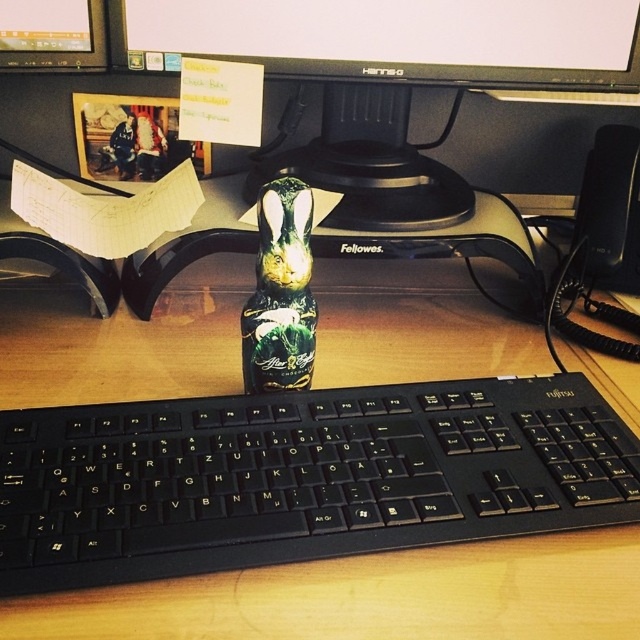
Which is more to the left, black glossy computer monitor at upper center or green matte bottle at center?

Positioned to the left is green matte bottle at center.

Is point (564, 28) positioned before point (250, 298)?

Yes, it is.

Where is `black glossy computer monitor at upper center`? This screenshot has height=640, width=640. black glossy computer monitor at upper center is located at coordinates (397, 38).

Who is more distant from viewer, [340,435] or [349,0]?

Positioned behind is point [349,0].

Can you confirm if black plastic keyboard at center is bigger than black glossy computer monitor at upper center?

Yes.

Where is `black plastic keyboard at center`? Image resolution: width=640 pixels, height=640 pixels. black plastic keyboard at center is located at coordinates (301, 476).

This screenshot has height=640, width=640. Describe the element at coordinates (301, 476) in the screenshot. I see `black plastic keyboard at center` at that location.

Locate an element on the screen. black plastic keyboard at center is located at coordinates (301, 476).

Is point (209, 509) positioned after point (627, 8)?

That is False.

The height and width of the screenshot is (640, 640). Find the location of `black plastic keyboard at center`. black plastic keyboard at center is located at coordinates (301, 476).